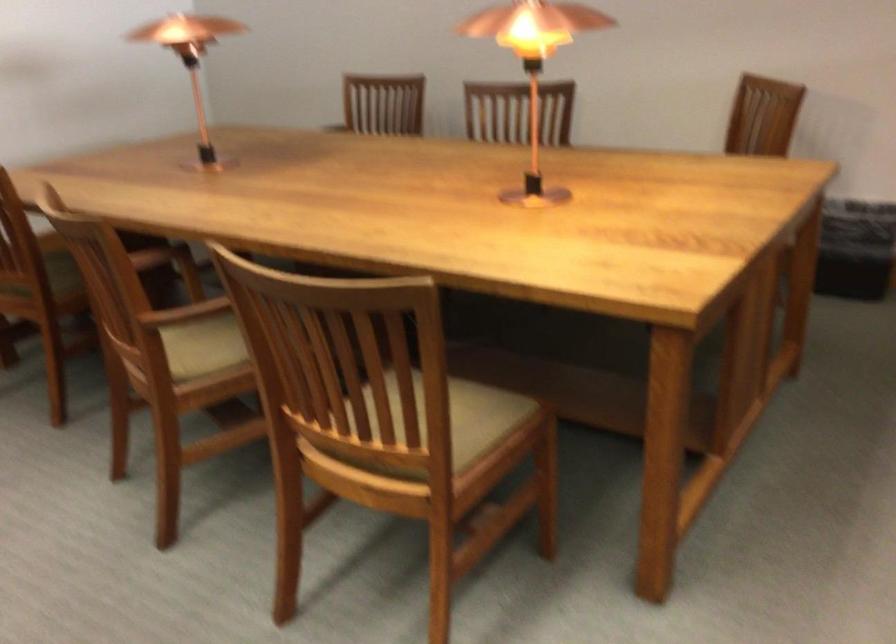
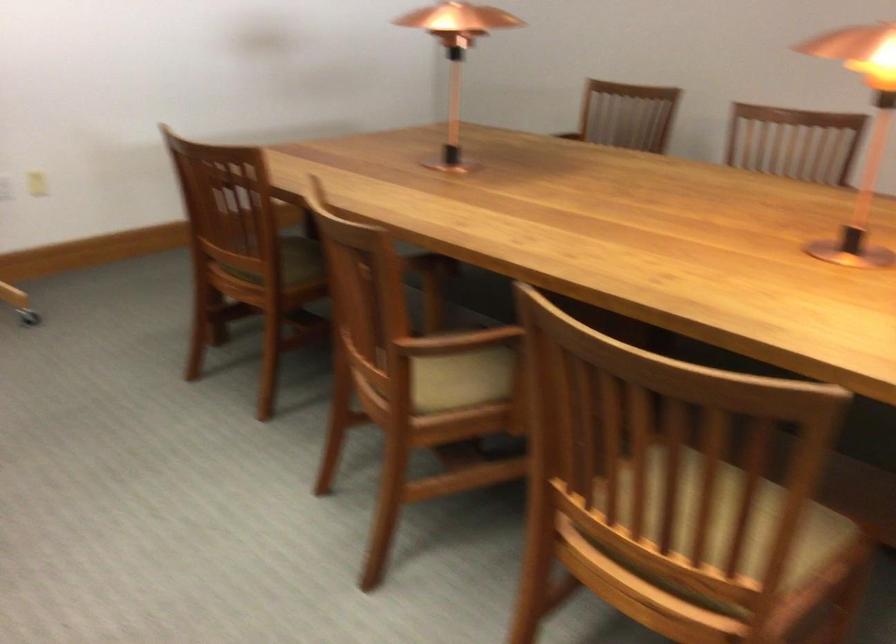
In the second image, find the point that corresponds to the point at 195,310 in the first image.

(455, 342)